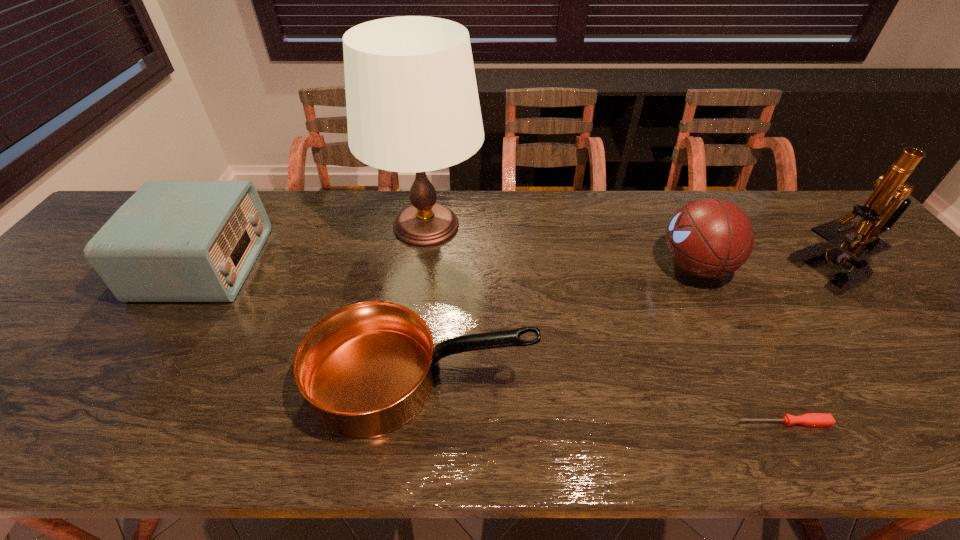
At what (x,y) coordinates should I click in order to perform the action: click on vacant space located 0.150m at the eyepiece of the rightmost object. Please return your answer as a coordinate pair (x, y). Image resolution: width=960 pixels, height=540 pixels. Looking at the image, I should click on (738, 271).

I want to click on vacant space situated on the front of the basketball, so click(x=748, y=373).

Image resolution: width=960 pixels, height=540 pixels. Find the location of `vacant region located on the front panel of the leftmost object`. vacant region located on the front panel of the leftmost object is located at coordinates (274, 264).

Where is `vacant space located on the handle side of the frying pan`? This screenshot has width=960, height=540. vacant space located on the handle side of the frying pan is located at coordinates (698, 380).

The width and height of the screenshot is (960, 540). I want to click on vacant space located 0.060m at the tip of the screwdriver, so (x=708, y=423).

At what (x,y) coordinates should I click in order to perform the action: click on vacant area situated 0.210m at the tip of the screwdriver. Please return your answer as a coordinate pair (x, y). Looking at the image, I should click on (632, 423).

Locate an element on the screen. This screenshot has height=540, width=960. blank area located 0.180m at the tip of the screwdriver is located at coordinates (647, 423).

At what (x,y) coordinates should I click in order to perform the action: click on lamp that is at the far edge. Please return your answer as a coordinate pair (x, y). The height and width of the screenshot is (540, 960). Looking at the image, I should click on (412, 102).

Locate an element on the screen. radio receiver situated at the far edge is located at coordinates (172, 241).

You are a GUI agent. You are given a task and a screenshot of the screen. Output one action in this format:
    pyautogui.click(x=<x>, y=<y>)
    Task: Click on the frying pan that is at the near edge
    
    Given the screenshot: What is the action you would take?
    pyautogui.click(x=366, y=369)